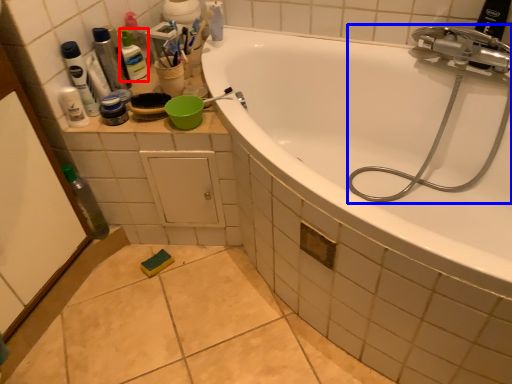
Question: Which object is closer to the camera taking this photo, toiletry (highlighted by a red box) or garden hose (highlighted by a blue box)?

Choices:
 (A) toiletry
 (B) garden hose

Answer: (B)